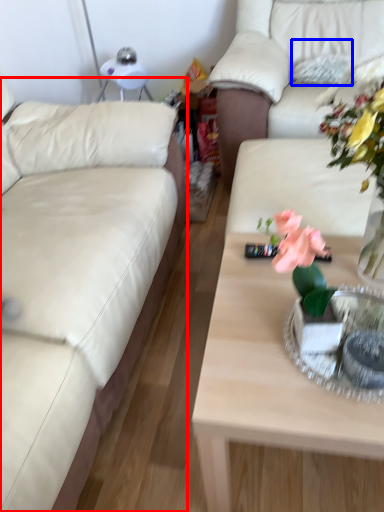
Question: Which object is closer to the camera taking this photo, studio couch (highlighted by a red box) or pillow (highlighted by a blue box)?

Choices:
 (A) studio couch
 (B) pillow

Answer: (A)